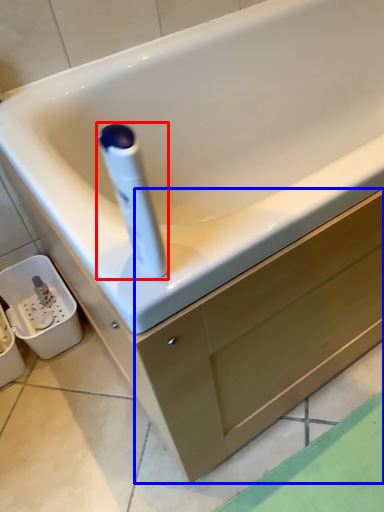
Question: Which of the following is the closest to the observer, cleaning product (highlighted by a red box) or drawer (highlighted by a blue box)?

Choices:
 (A) cleaning product
 (B) drawer

Answer: (A)